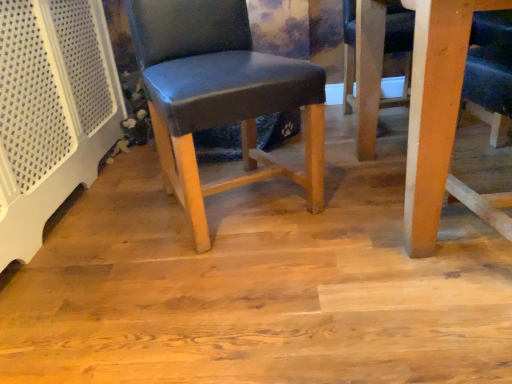
Question: From a real-world perspective, is matte wood floor at center above or below wooden table at lower right?

Choices:
 (A) below
 (B) above

Answer: (A)

Question: Considering the positions of matte wood floor at center and wooden table at lower right in the image, is matte wood floor at center taller or shorter than wooden table at lower right?

Choices:
 (A) short
 (B) tall

Answer: (A)

Question: Estimate the real-world distances between objects in this image. Which object is closer to the matte blue leather chair at center?

Choices:
 (A) wooden table at lower right
 (B) matte wood floor at center

Answer: (B)

Question: Considering the real-world distances, which object is farthest from the wooden table at lower right?

Choices:
 (A) matte wood floor at center
 (B) matte blue leather chair at center

Answer: (B)